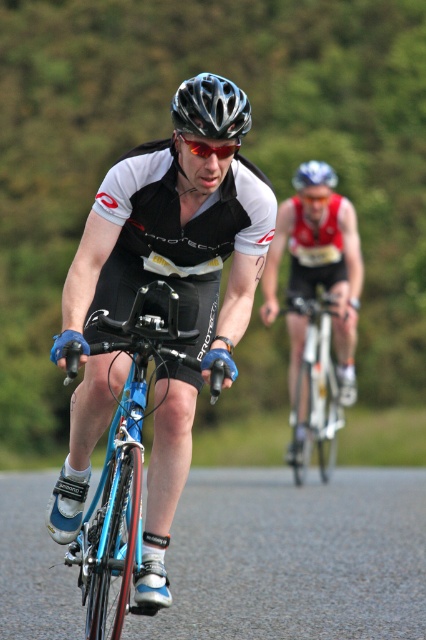
Question: Can you confirm if matte black cycling jersey at center is thinner than blue matte helmet at upper center?

Choices:
 (A) no
 (B) yes

Answer: (B)

Question: Observing the image, what is the correct spatial positioning of matte black helmet at center in reference to black reflective lens goggles at center?

Choices:
 (A) right
 (B) left

Answer: (B)

Question: Which point is farther from the camera taking this photo?

Choices:
 (A) (311, 308)
 (B) (184, 93)

Answer: (A)

Question: Can you confirm if matte black cycling jersey at center is wider than blue metallic bicycle at center?

Choices:
 (A) no
 (B) yes

Answer: (B)

Question: Which of the following is the closest to the observer?

Choices:
 (A) (226, 147)
 (B) (118, 536)
 (C) (313, 163)
 (D) (172, 412)

Answer: (A)

Question: Estimate the real-world distances between objects in this image. Which object is closer to the shiny silver bicycle at center?

Choices:
 (A) matte black helmet at center
 (B) black reflective lens goggles at center

Answer: (A)